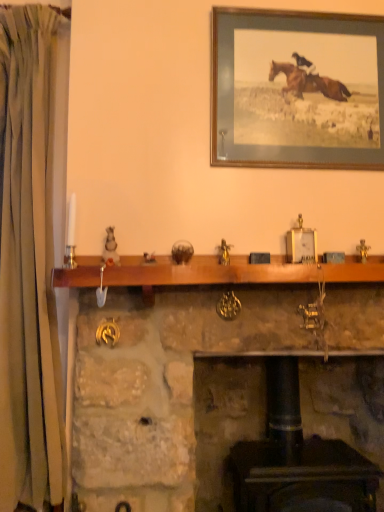
Question: Can you confirm if stone fireplace at center is thinner than green fabric curtain at left?

Choices:
 (A) yes
 (B) no

Answer: (B)

Question: Can you confirm if stone fireplace at center is taller than green fabric curtain at left?

Choices:
 (A) yes
 (B) no

Answer: (B)

Question: Is stone fireplace at center oriented towards green fabric curtain at left?

Choices:
 (A) yes
 (B) no

Answer: (B)

Question: From a real-world perspective, is stone fireplace at center under green fabric curtain at left?

Choices:
 (A) no
 (B) yes

Answer: (B)

Question: Can you confirm if stone fireplace at center is smaller than green fabric curtain at left?

Choices:
 (A) no
 (B) yes

Answer: (A)

Question: Is stone fireplace at center further to camera compared to green fabric curtain at left?

Choices:
 (A) yes
 (B) no

Answer: (B)

Question: From a real-world perspective, is wooden mantle at center physically below wooden picture frame at upper center?

Choices:
 (A) yes
 (B) no

Answer: (A)

Question: From the image's perspective, is wooden mantle at center below wooden picture frame at upper center?

Choices:
 (A) yes
 (B) no

Answer: (A)

Question: Can you confirm if wooden mantle at center is bigger than wooden picture frame at upper center?

Choices:
 (A) yes
 (B) no

Answer: (A)

Question: Can you confirm if wooden mantle at center is taller than wooden picture frame at upper center?

Choices:
 (A) no
 (B) yes

Answer: (A)

Question: Would you say wooden mantle at center is outside wooden picture frame at upper center?

Choices:
 (A) no
 (B) yes

Answer: (B)

Question: Is wooden mantle at center to the left of wooden picture frame at upper center from the viewer's perspective?

Choices:
 (A) no
 (B) yes

Answer: (B)

Question: Is green fabric curtain at left in front of wooden mantle at center?

Choices:
 (A) no
 (B) yes

Answer: (A)